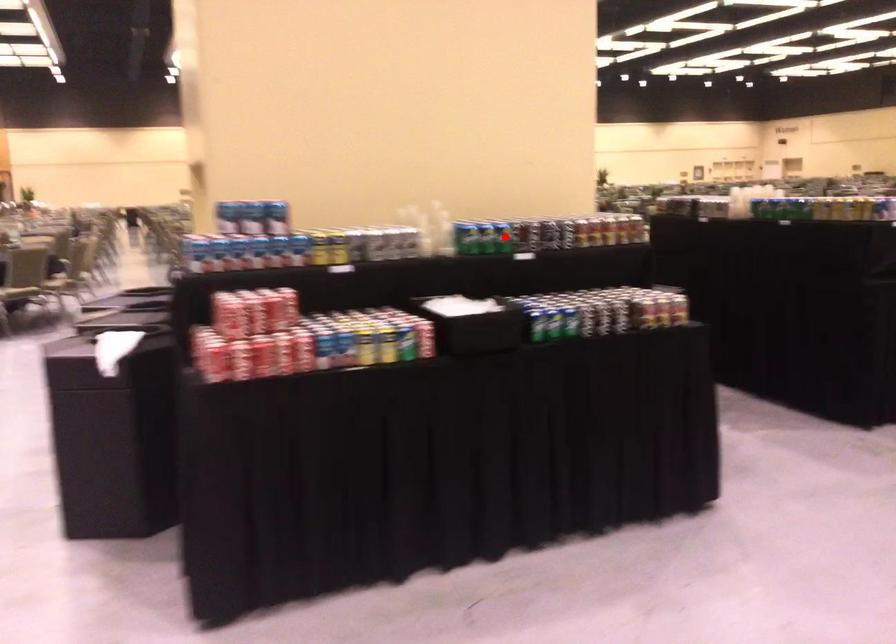
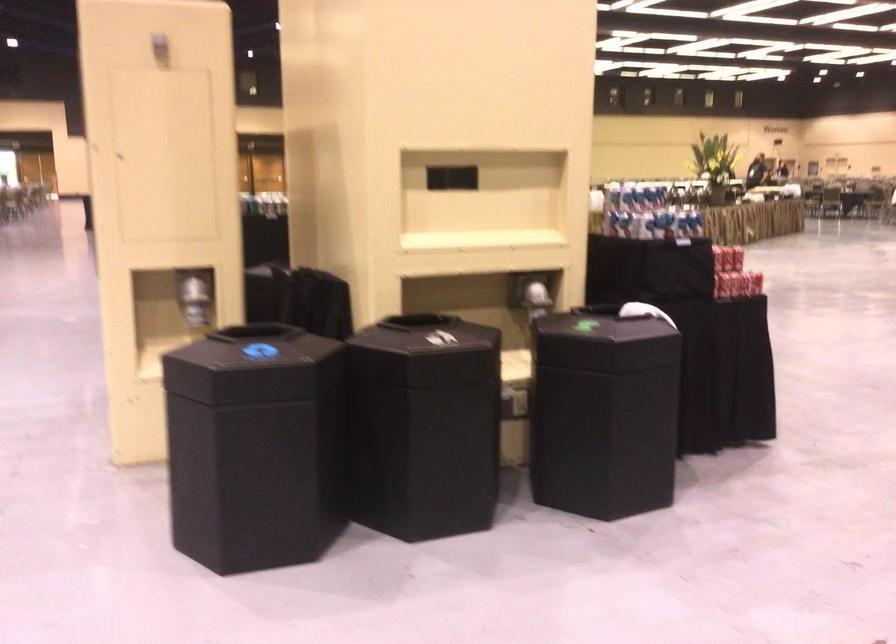
Question: I am providing you with two images of the same scene from different viewpoints. A red point is marked on the first image. Is the red point's position out of view in image 2?

Choices:
 (A) Yes
 (B) No

Answer: (A)